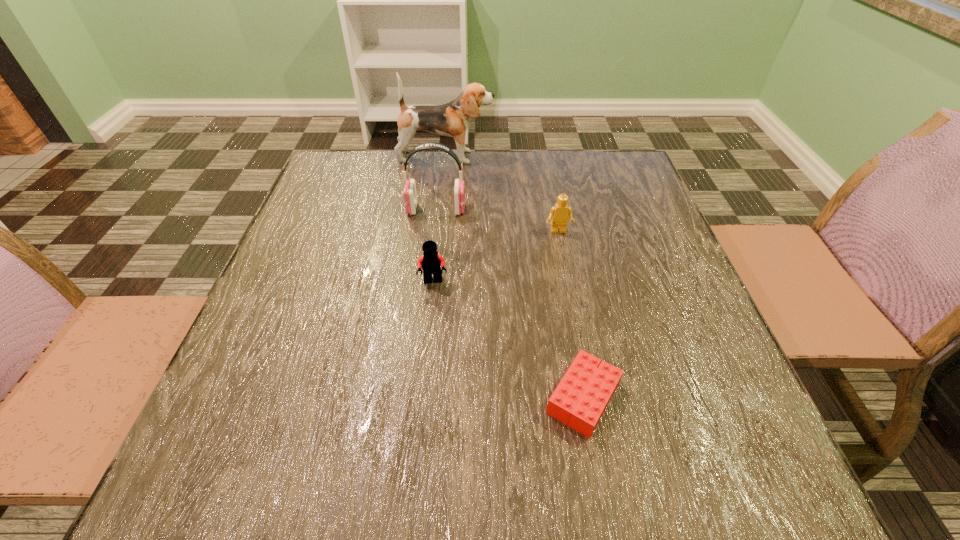
I want to click on the tallest object, so click(452, 119).

The image size is (960, 540). In order to click on the farthest object in this screenshot , I will do `click(452, 119)`.

You are a GUI agent. You are given a task and a screenshot of the screen. Output one action in this format:
    pyautogui.click(x=<x>, y=<y>)
    Task: Click on the earphone
    
    Given the screenshot: What is the action you would take?
    pyautogui.click(x=410, y=195)

The image size is (960, 540). In order to click on the fourth shortest object in this screenshot , I will do `click(410, 195)`.

You are a GUI agent. You are given a task and a screenshot of the screen. Output one action in this format:
    pyautogui.click(x=<x>, y=<y>)
    Task: Click on the second nearest Lego
    This screenshot has height=540, width=960.
    Given the screenshot: What is the action you would take?
    pyautogui.click(x=431, y=262)

Identify the location of the leftmost Lego. [x=431, y=262].

I want to click on the third farthest object, so click(x=559, y=215).

What are the coordinates of `the nearest Lego` in the screenshot? It's located at (580, 399).

Locate an element on the screen. This screenshot has width=960, height=540. the nearest object is located at coordinates (580, 399).

At what (x,y) coordinates should I click in order to perform the action: click on free space located 0.150m at the face of the puppy. Please return your answer as a coordinate pair (x, y). Looking at the image, I should click on (545, 157).